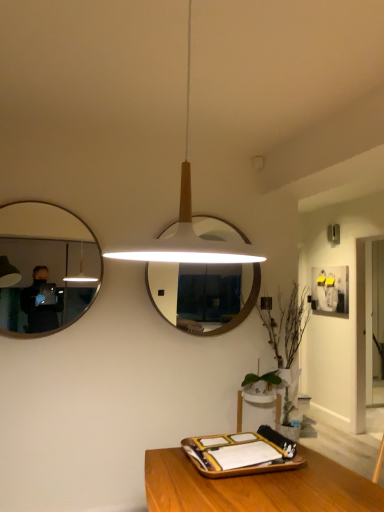
The width and height of the screenshot is (384, 512). In order to click on matte black mirror at left, which is counted as the second mirror, starting from the back in this screenshot , I will do [47, 267].

This screenshot has width=384, height=512. Find the location of `white matte pendant light at center`. white matte pendant light at center is located at coordinates coord(186,222).

Image resolution: width=384 pixels, height=512 pixels. Find the location of `wooden tray at lower center`. wooden tray at lower center is located at coordinates (240, 454).

Find the location of a particular element. white wooden mirror at center, which is the first mirror in right-to-left order is located at coordinates (164, 288).

Considering the relative positions of matte black mirror at left, the 2th mirror in the right-to-left sequence, and white matte pendant light at center in the image provided, is matte black mirror at left, the 2th mirror in the right-to-left sequence, in front of white matte pendant light at center?

No, it is not.

You are a GUI agent. You are given a task and a screenshot of the screen. Output one action in this format:
    pyautogui.click(x=<x>, y=<y>)
    Task: Click on the mirror that is the 1st object located behind the white matte pendant light at center
    
    Given the screenshot: What is the action you would take?
    pyautogui.click(x=47, y=267)

Does matte black mirror at left, which is counted as the second mirror, starting from the back, have a lesser height compared to white matte pendant light at center?

Incorrect, the height of matte black mirror at left, which is counted as the second mirror, starting from the back, does not fall short of that of white matte pendant light at center.

Based on the photo, is matte black mirror at left, acting as the first mirror starting from the front, looking in the opposite direction of white matte pendant light at center?

No, matte black mirror at left, acting as the first mirror starting from the front, is not facing away from white matte pendant light at center.

Would you say wooden tray at lower center is outside white wooden mirror at center, which is the first mirror in right-to-left order?

That's correct, wooden tray at lower center is outside of white wooden mirror at center, which is the first mirror in right-to-left order.

From a real-world perspective, starting from the wooden tray at lower center, which mirror is the 1st one vertically above it? Please provide its 2D coordinates.

[(164, 288)]

Does point (219, 477) come closer to viewer compared to point (164, 279)?

Yes, point (219, 477) is closer to viewer.

Which object is closer to the camera, wooden tray at lower center or white wooden mirror at center, which is the first mirror in right-to-left order?

wooden tray at lower center is more forward.

Is wooden tray at lower center completely or partially inside matte black mirror at left, the 2th mirror in the right-to-left sequence?

No, wooden tray at lower center is not a part of matte black mirror at left, the 2th mirror in the right-to-left sequence.

Is wooden tray at lower center at the back of matte black mirror at left, which is the 1th mirror from left to right?

That's not correct — matte black mirror at left, which is the 1th mirror from left to right, is not looking away from wooden tray at lower center.

Which of these two, matte black mirror at left, which is counted as the second mirror, starting from the back, or wooden tray at lower center, stands shorter?

With less height is wooden tray at lower center.

Is matte black mirror at left, acting as the first mirror starting from the front, in front of or behind wooden tray at lower center in the image?

Visually, matte black mirror at left, acting as the first mirror starting from the front, is located behind wooden tray at lower center.

In terms of height, does white matte pendant light at center look taller or shorter compared to wooden tray at lower center?

Considering their sizes, white matte pendant light at center has more height than wooden tray at lower center.

Considering the positions of objects white matte pendant light at center and wooden tray at lower center in the image provided, who is behind, white matte pendant light at center or wooden tray at lower center?

wooden tray at lower center.

Is white matte pendant light at center at the right side of wooden tray at lower center?

No, white matte pendant light at center is not to the right of wooden tray at lower center.

From a real-world perspective, between white matte pendant light at center and wooden tray at lower center, who is vertically lower?

wooden tray at lower center, from a real-world perspective.

Which is behind, white matte pendant light at center or white wooden mirror at center, marked as the 2th mirror in a left-to-right arrangement?

white wooden mirror at center, marked as the 2th mirror in a left-to-right arrangement, is further away from the camera.

Can you see white matte pendant light at center touching white wooden mirror at center, which is the first mirror in right-to-left order?

No, white matte pendant light at center is not next to white wooden mirror at center, which is the first mirror in right-to-left order.

From a real-world perspective, which object stands above the other?

From a 3D spatial view, white matte pendant light at center is above.

How much distance is there between white matte pendant light at center and white wooden mirror at center, which is the 1th mirror from back to front?

white matte pendant light at center and white wooden mirror at center, which is the 1th mirror from back to front, are 1.89 meters apart.

Can you tell me how much green leafy plant at lower right and matte black mirror at left, which is the 1th mirror from left to right, differ in facing direction?

The angle between the facing direction of green leafy plant at lower right and the facing direction of matte black mirror at left, which is the 1th mirror from left to right, is 0.00453 degrees.

Can you confirm if green leafy plant at lower right is shorter than matte black mirror at left, acting as the first mirror starting from the front?

No.

From a real-world perspective, is green leafy plant at lower right under matte black mirror at left, the 2th mirror in the right-to-left sequence?

Yes.

From the image's perspective, is matte black mirror at left, acting as the first mirror starting from the front, located above green leafy plant at lower right?

Yes.

Is matte black mirror at left, acting as the first mirror starting from the front, turned away from green leafy plant at lower right?

matte black mirror at left, acting as the first mirror starting from the front, does not have its back to green leafy plant at lower right.

Is the depth of matte black mirror at left, which is counted as the second mirror, starting from the back, greater than that of green leafy plant at lower right?

No, the depth of matte black mirror at left, which is counted as the second mirror, starting from the back, is less than that of green leafy plant at lower right.

Do you think matte black mirror at left, which is counted as the second mirror, starting from the back, is within green leafy plant at lower right, or outside of it?

The correct answer is: outside.

The width and height of the screenshot is (384, 512). There is a white matte pendant light at center. Identify the location of the 1st mirror below it (from the image's perspective). (47, 267).

Starting from the wooden tray at lower center, which mirror is the 1st one to the left? Please provide its 2D coordinates.

[(164, 288)]

Which object lies nearer to the anchor point white matte pendant light at center, matte black mirror at left, acting as the first mirror starting from the front, or matte white picture frame at upper right?

Among the two, matte black mirror at left, acting as the first mirror starting from the front, is located nearer to white matte pendant light at center.

When comparing their distances from matte black mirror at left, which is the 1th mirror from left to right, does white wooden mirror at center, which is the first mirror in right-to-left order, or green leafy plant at lower right seem further?

Based on the image, green leafy plant at lower right appears to be further to matte black mirror at left, which is the 1th mirror from left to right.

From the image, which object appears to be nearer to matte white picture frame at upper right, white matte pendant light at center or green leafy plant at lower right?

green leafy plant at lower right is positioned closer to the anchor matte white picture frame at upper right.

Which object lies nearer to the anchor point white wooden mirror at center, which is the 1th mirror from back to front, matte white picture frame at upper right or wooden tray at lower center?

wooden tray at lower center is closer to white wooden mirror at center, which is the 1th mirror from back to front.

Based on their spatial positions, is wooden tray at lower center or green leafy plant at lower right closer to white wooden mirror at center, which is the 1th mirror from back to front?

Based on the image, green leafy plant at lower right appears to be nearer to white wooden mirror at center, which is the 1th mirror from back to front.

When comparing their distances from white wooden mirror at center, marked as the 2th mirror in a left-to-right arrangement, does green leafy plant at lower right or wooden tray at lower center seem closer?

The object closer to white wooden mirror at center, marked as the 2th mirror in a left-to-right arrangement, is green leafy plant at lower right.

In the scene shown: When comparing their distances from matte black mirror at left, which is the 1th mirror from left to right, does matte white picture frame at upper right or green leafy plant at lower right seem further?

matte white picture frame at upper right is positioned further to the anchor matte black mirror at left, which is the 1th mirror from left to right.

Which object lies further to the anchor point matte black mirror at left, which is counted as the second mirror, starting from the back, green leafy plant at lower right or matte white picture frame at upper right?

Among the two, matte white picture frame at upper right is located further to matte black mirror at left, which is counted as the second mirror, starting from the back.

The height and width of the screenshot is (512, 384). I want to click on plant located between white matte pendant light at center and matte white picture frame at upper right in the depth direction, so click(287, 325).

Locate an element on the screen. Image resolution: width=384 pixels, height=512 pixels. tray between matte black mirror at left, the 2th mirror in the right-to-left sequence, and green leafy plant at lower right, in the horizontal direction is located at coordinates (240, 454).

I want to click on mirror between matte black mirror at left, the 2th mirror in the right-to-left sequence, and wooden tray at lower center from left to right, so coord(164,288).

Locate an element on the screen. plant between white wooden mirror at center, which is the 1th mirror from back to front, and matte white picture frame at upper right, along the z-axis is located at coordinates (287, 325).